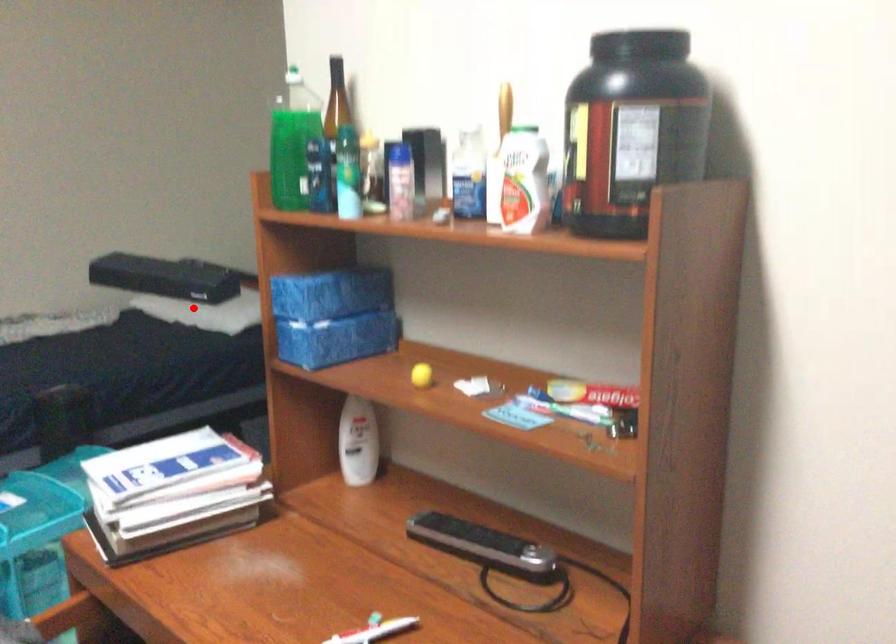
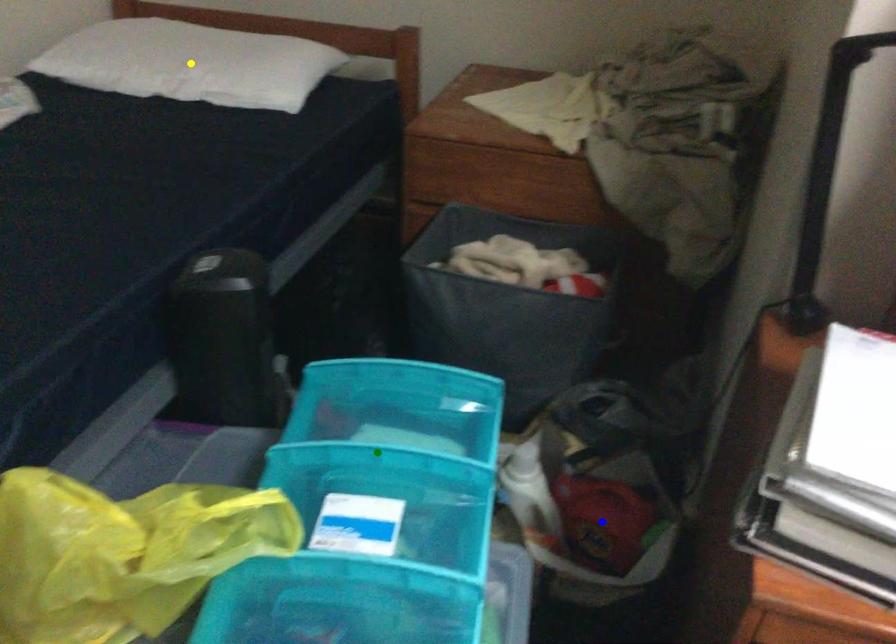
Question: I am providing you with two images of the same scene from different viewpoints. A red point is marked on the first image. You are given multiple points on the second image. Which point in image 2 is actually the same real-world point as the red point in image 1?

Choices:
 (A) green point
 (B) yellow point
 (C) blue point

Answer: (B)